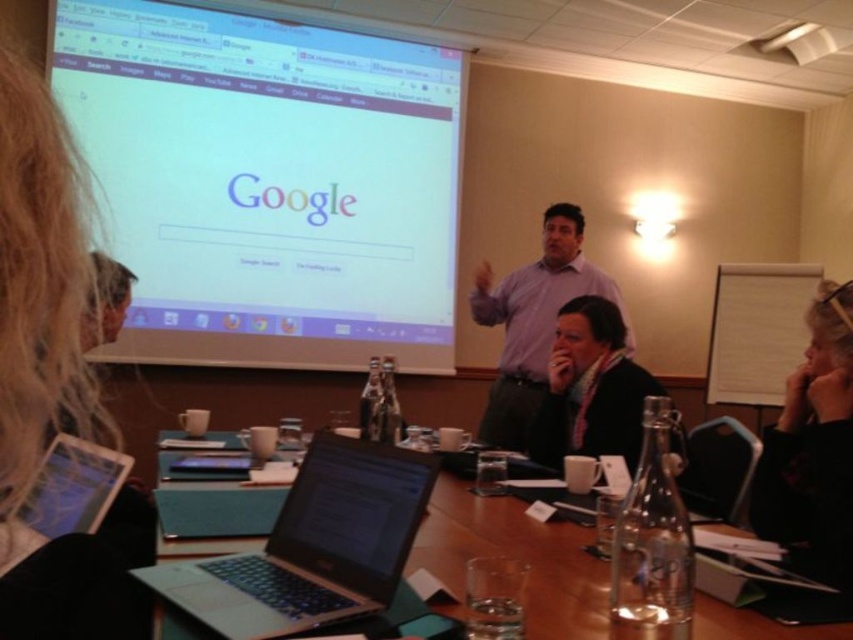
What is the position of the black fabric hair at upper right in the image?

The black fabric hair at upper right is located at point (813, 448).

You are an interior designer analyzing the meeting room layout. You notice the black fabric hair at upper right and the dark gray sweater at lower center. Which object has a smaller width?

The black fabric hair at upper right is thinner than the dark gray sweater at lower center, so the black fabric hair at upper right has a smaller width.